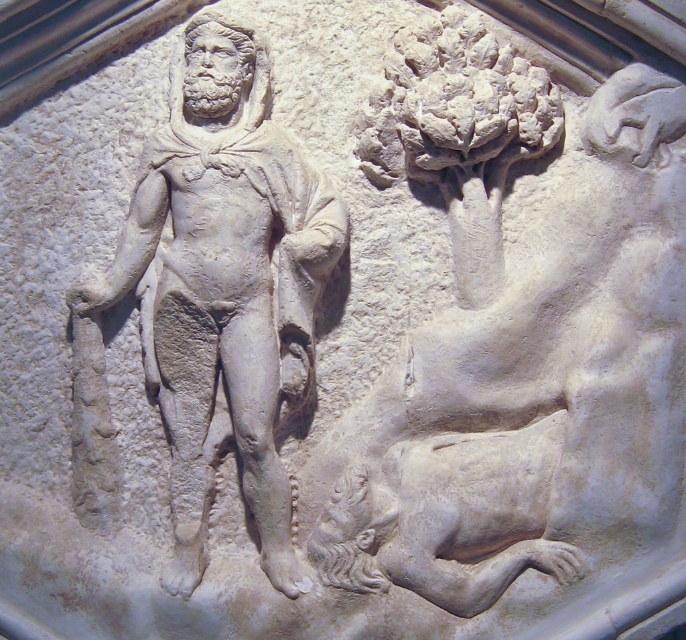
In the scene shown: Can you confirm if white stone tree at upper center is shorter than white stone god at center?

No.

From the picture: Is white stone tree at upper center to the right of white stone god at center from the viewer's perspective?

Indeed, white stone tree at upper center is positioned on the right side of white stone god at center.

Image resolution: width=686 pixels, height=640 pixels. What are the coordinates of `white stone tree at upper center` in the screenshot? It's located at (517, 346).

The height and width of the screenshot is (640, 686). I want to click on white stone tree at upper center, so click(517, 346).